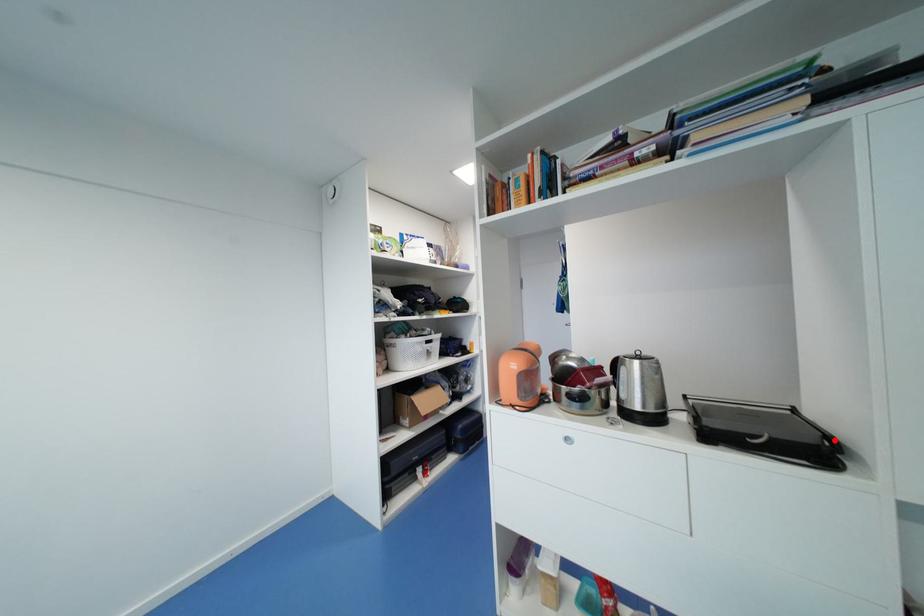
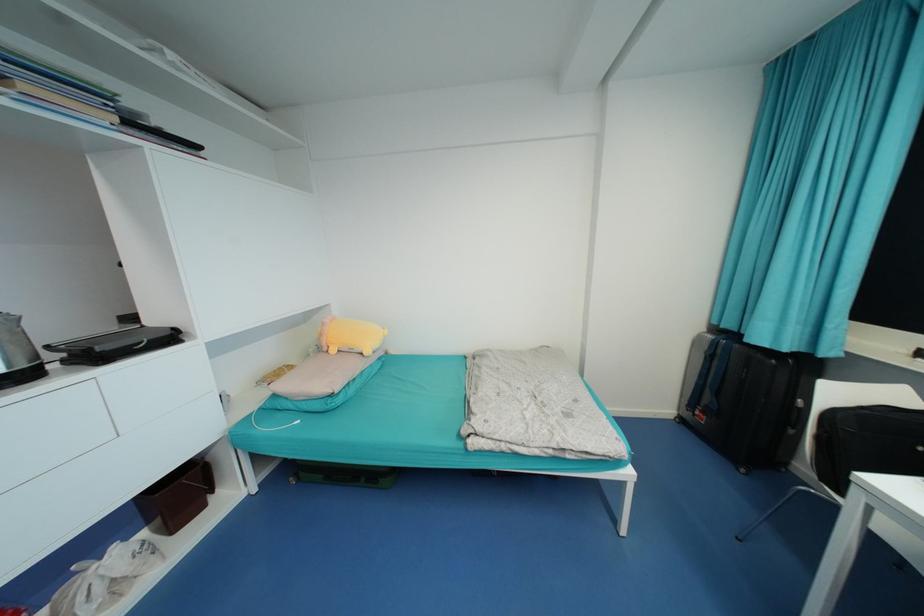
The point at the highlighted location is marked in the first image. Where is the corresponding point in the second image?

(179, 330)